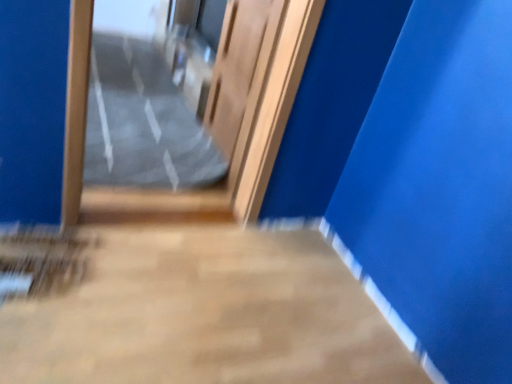
Question: From a real-world perspective, does wooden door at center sit lower than wooden door at center?

Choices:
 (A) yes
 (B) no

Answer: (A)

Question: From a real-world perspective, is wooden door at center physically above wooden door at center?

Choices:
 (A) no
 (B) yes

Answer: (A)

Question: Is wooden door at center not within wooden door at center?

Choices:
 (A) yes
 (B) no

Answer: (A)

Question: From the image's perspective, does wooden door at center appear lower than wooden door at center?

Choices:
 (A) yes
 (B) no

Answer: (B)

Question: From the image's perspective, does wooden door at center appear higher than wooden door at center?

Choices:
 (A) no
 (B) yes

Answer: (B)

Question: Could you tell me if wooden door at center is turned towards wooden door at center?

Choices:
 (A) no
 (B) yes

Answer: (A)

Question: Considering the relative sizes of clear plastic bag at center and wooden door at center in the image provided, is clear plastic bag at center thinner than wooden door at center?

Choices:
 (A) yes
 (B) no

Answer: (B)

Question: Could you tell me if clear plastic bag at center is facing wooden door at center?

Choices:
 (A) yes
 (B) no

Answer: (A)

Question: From a real-world perspective, does clear plastic bag at center sit lower than wooden door at center?

Choices:
 (A) no
 (B) yes

Answer: (B)

Question: Can you confirm if clear plastic bag at center is positioned to the right of wooden door at center?

Choices:
 (A) no
 (B) yes

Answer: (A)

Question: Is there a large distance between clear plastic bag at center and wooden door at center?

Choices:
 (A) yes
 (B) no

Answer: (B)

Question: Can you confirm if clear plastic bag at center is bigger than wooden door at center?

Choices:
 (A) yes
 (B) no

Answer: (A)

Question: Does clear plastic bag at center have a greater height compared to wooden door at center?

Choices:
 (A) yes
 (B) no

Answer: (B)